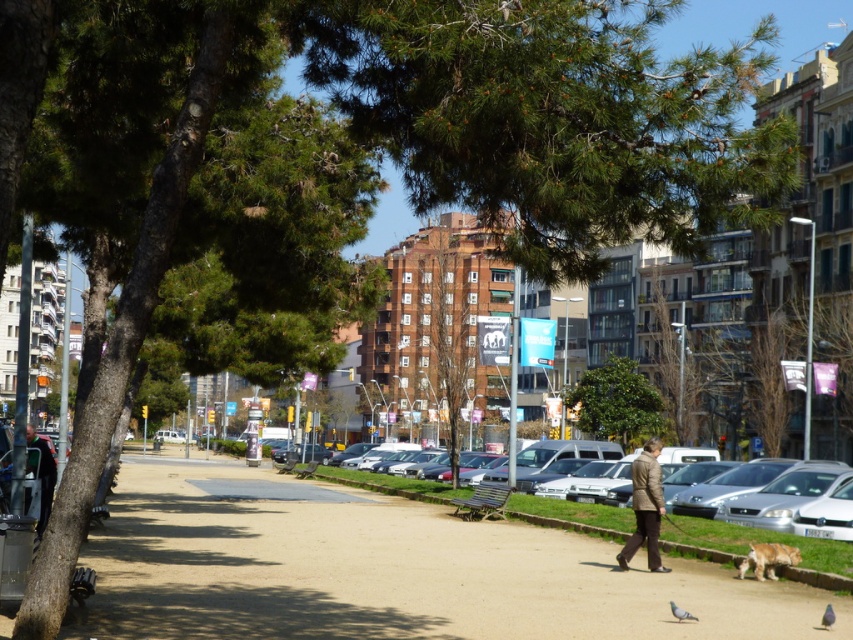
Question: Does green leafy tree at center have a smaller size compared to gray matte pigeon at lower center?

Choices:
 (A) no
 (B) yes

Answer: (A)

Question: Does smooth concrete path at center appear over golden fur dog at lower right?

Choices:
 (A) yes
 (B) no

Answer: (B)

Question: Which point appears farthest from the camera in this image?

Choices:
 (A) click(579, 385)
 (B) click(596, 518)
 (C) click(776, 548)

Answer: (A)

Question: Which object appears farthest from the camera in this image?

Choices:
 (A) golden fur dog at lower right
 (B) dark brown leather jacket at left
 (C) green leafy tree at center

Answer: (C)

Question: Can you confirm if green leafy tree at center is bigger than brown leather jacket at lower center?

Choices:
 (A) no
 (B) yes

Answer: (A)

Question: Among these points, which one is nearest to the camera?

Choices:
 (A) (38, 444)
 (B) (830, 616)

Answer: (B)